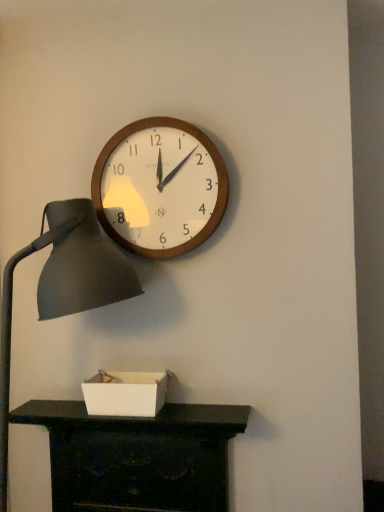
Question: Is matte black lamp at left oriented away from wooden wall clock at upper center?

Choices:
 (A) no
 (B) yes

Answer: (A)

Question: Considering the relative sizes of matte black lamp at left and wooden wall clock at upper center in the image provided, is matte black lamp at left thinner than wooden wall clock at upper center?

Choices:
 (A) yes
 (B) no

Answer: (B)

Question: Can you confirm if matte black lamp at left is smaller than wooden wall clock at upper center?

Choices:
 (A) yes
 (B) no

Answer: (B)

Question: From the image's perspective, does matte black lamp at left appear higher than wooden wall clock at upper center?

Choices:
 (A) yes
 (B) no

Answer: (B)

Question: Is the depth of matte black lamp at left less than that of wooden wall clock at upper center?

Choices:
 (A) no
 (B) yes

Answer: (B)

Question: Would you say matte black lamp at left is to the left or to the right of white cardboard box at lower center in the picture?

Choices:
 (A) left
 (B) right

Answer: (A)

Question: In the image, is matte black lamp at left positioned in front of or behind white cardboard box at lower center?

Choices:
 (A) front
 (B) behind

Answer: (A)

Question: Is matte black lamp at left spatially inside white cardboard box at lower center, or outside of it?

Choices:
 (A) outside
 (B) inside

Answer: (A)

Question: Based on their sizes in the image, would you say matte black lamp at left is bigger or smaller than white cardboard box at lower center?

Choices:
 (A) big
 (B) small

Answer: (A)

Question: From a real-world perspective, is white cardboard box at lower center above or below matte black lamp at left?

Choices:
 (A) below
 (B) above

Answer: (A)

Question: Is white cardboard box at lower center in front of or behind matte black lamp at left in the image?

Choices:
 (A) front
 (B) behind

Answer: (B)

Question: Considering the relative positions of white cardboard box at lower center and matte black lamp at left in the image provided, is white cardboard box at lower center to the left or to the right of matte black lamp at left?

Choices:
 (A) right
 (B) left

Answer: (A)

Question: Which is correct: white cardboard box at lower center is inside matte black lamp at left, or outside of it?

Choices:
 (A) outside
 (B) inside

Answer: (B)

Question: Is matte black desk at lower center in front of or behind wooden wall clock at upper center in the image?

Choices:
 (A) behind
 (B) front

Answer: (B)

Question: Is matte black desk at lower center wider or thinner than wooden wall clock at upper center?

Choices:
 (A) thin
 (B) wide

Answer: (B)